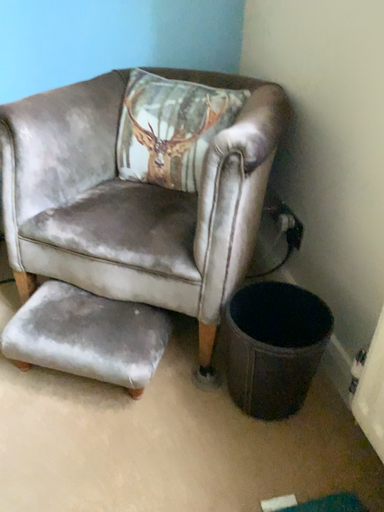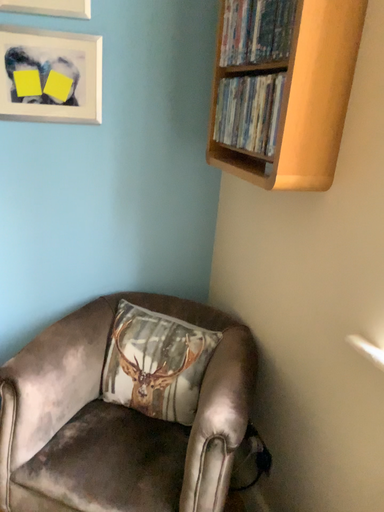
Question: Which way did the camera rotate in the video?

Choices:
 (A) rotated right
 (B) rotated left

Answer: (A)